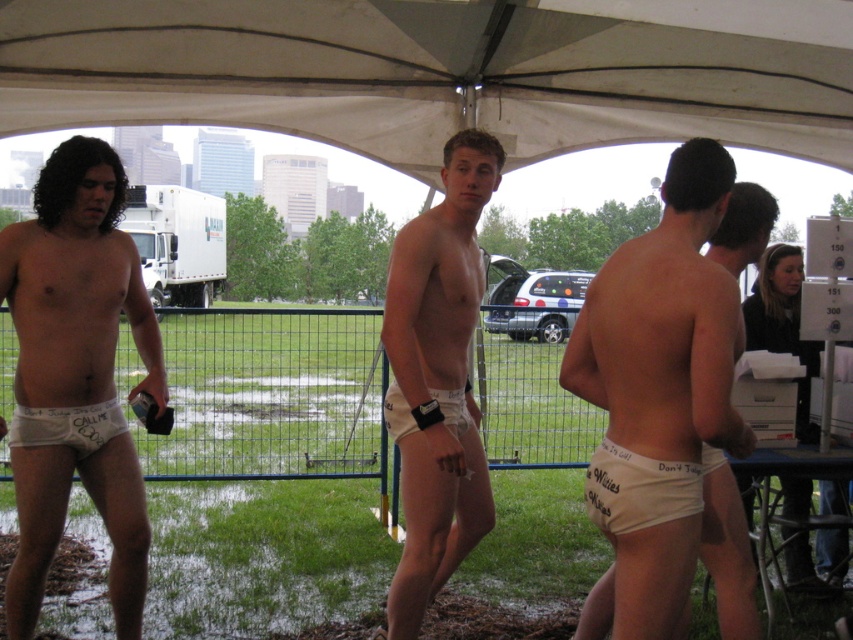
Does white cotton underwear at center have a greater height compared to white matte underwear at center?

In fact, white cotton underwear at center may be shorter than white matte underwear at center.

Which is above, white cotton underwear at center or white matte underwear at center?

Positioned higher is white matte underwear at center.

Measure the distance between point (701, 308) and camera.

A distance of 2.38 meters exists between point (701, 308) and camera.

Identify the location of white cotton underwear at center. (666, 324).

Who is higher up, white matte underwear at left or white cotton underwear at lower right?

white matte underwear at left is higher up.

Between white matte underwear at left and white cotton underwear at lower right, which one has less height?

white cotton underwear at lower right

This screenshot has height=640, width=853. In order to click on white matte underwear at left in this screenshot , I will do `click(76, 376)`.

Locate an element on the screen. The image size is (853, 640). white matte underwear at left is located at coordinates (76, 376).

Between point (236, 0) and point (637, 484), which one is positioned behind?

Positioned behind is point (236, 0).

Between point (239, 36) and point (602, 525), which one is positioned in front?

Positioned in front is point (602, 525).

This screenshot has width=853, height=640. What are the coordinates of `white fabric canopy at upper center` in the screenshot? It's located at (440, 72).